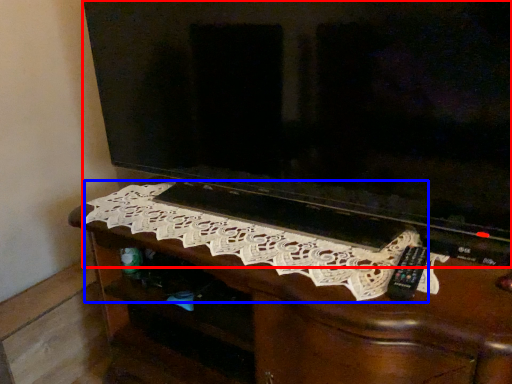
Question: Which object is closer to the camera taking this photo, television (highlighted by a red box) or embroidery (highlighted by a blue box)?

Choices:
 (A) television
 (B) embroidery

Answer: (A)